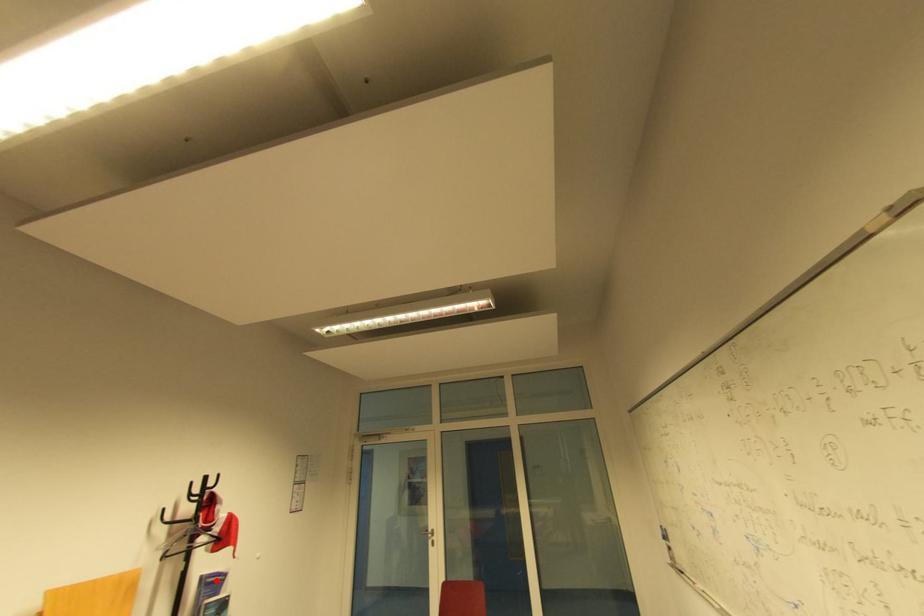
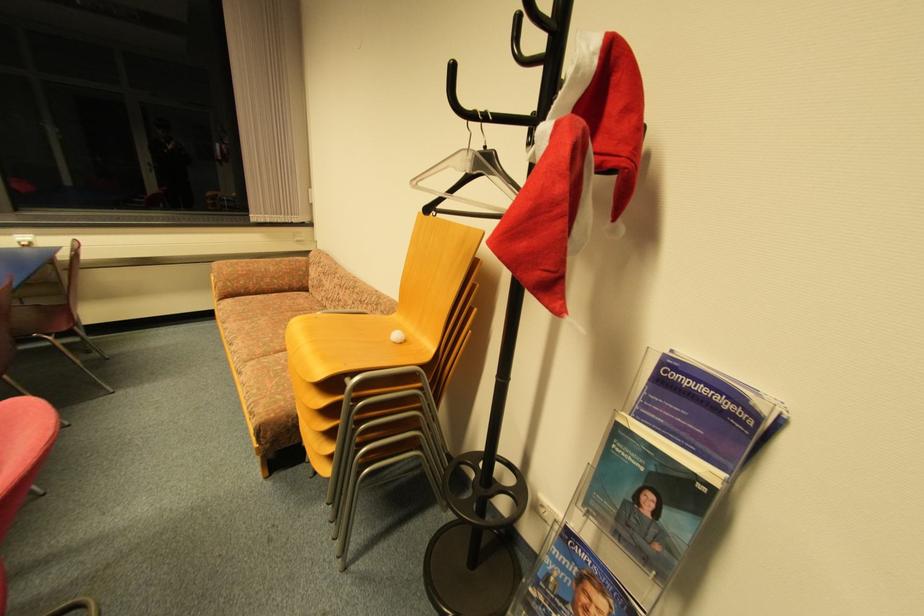
Locate, in the second image, the point that corresponds to the highlighted location in the first image.

(708, 391)